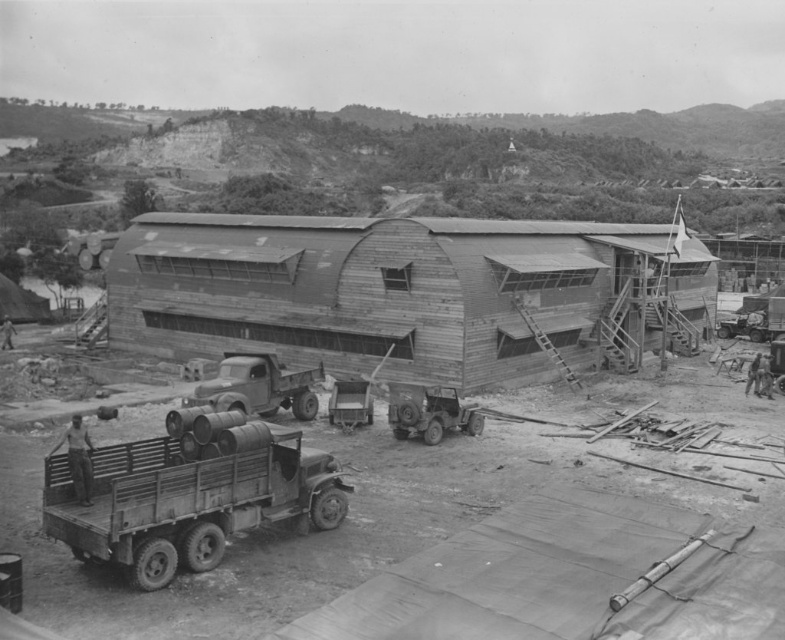
Between point (141, 316) and point (229, 400), which one is positioned in front?

Point (229, 400) is more forward.

Where is `wooden hut at center`? Image resolution: width=785 pixels, height=640 pixels. wooden hut at center is located at coordinates (409, 294).

From the picture: Who is lower down, rusty metal truck at lower left or matte gray truck at center?

rusty metal truck at lower left is lower down.

At what (x,y) coordinates should I click in order to perform the action: click on rusty metal truck at lower left. Please return your answer as a coordinate pair (x, y). Image resolution: width=785 pixels, height=640 pixels. Looking at the image, I should click on point(188,493).

Between point (181, 484) and point (298, 374), which one is positioned behind?

Point (298, 374)

In order to click on rusty metal truck at lower left in this screenshot , I will do `click(188, 493)`.

Based on the photo, is wooden hut at center to the right of rusty metal truck at lower left from the viewer's perspective?

Correct, you'll find wooden hut at center to the right of rusty metal truck at lower left.

Is point (420, 221) positioned behind point (325, 515)?

Yes, it is behind point (325, 515).

Is point (320, 348) farther from camera compared to point (225, 493)?

Yes, point (320, 348) is behind point (225, 493).

This screenshot has width=785, height=640. I want to click on wooden hut at center, so click(409, 294).